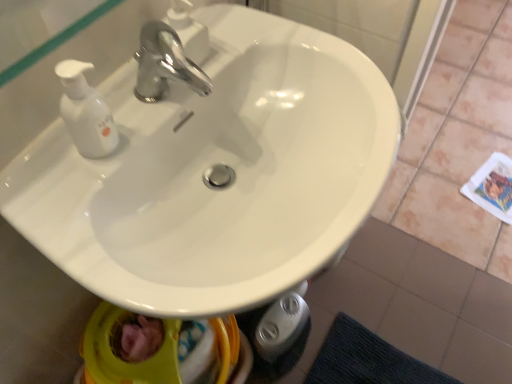
Question: From a real-world perspective, is chrome metallic faucet at upper center positioned under white glossy sink at center based on gravity?

Choices:
 (A) yes
 (B) no

Answer: (B)

Question: From the image's perspective, does chrome metallic faucet at upper center appear lower than white glossy sink at center?

Choices:
 (A) no
 (B) yes

Answer: (A)

Question: Can you confirm if chrome metallic faucet at upper center is taller than white glossy sink at center?

Choices:
 (A) no
 (B) yes

Answer: (A)

Question: Does chrome metallic faucet at upper center have a greater width compared to white glossy sink at center?

Choices:
 (A) no
 (B) yes

Answer: (A)

Question: Is chrome metallic faucet at upper center not near white glossy sink at center?

Choices:
 (A) yes
 (B) no

Answer: (B)

Question: Is chrome metallic faucet at upper center facing towards white glossy sink at center?

Choices:
 (A) no
 (B) yes

Answer: (A)

Question: From the image's perspective, is white glossy sink at center over chrome metallic faucet at upper center?

Choices:
 (A) yes
 (B) no

Answer: (B)

Question: Is white glossy sink at center positioned beyond the bounds of chrome metallic faucet at upper center?

Choices:
 (A) no
 (B) yes

Answer: (B)

Question: Can you confirm if white glossy sink at center is shorter than chrome metallic faucet at upper center?

Choices:
 (A) yes
 (B) no

Answer: (B)

Question: Is white glossy sink at center aimed at chrome metallic faucet at upper center?

Choices:
 (A) no
 (B) yes

Answer: (A)

Question: From a real-world perspective, is white glossy sink at center beneath chrome metallic faucet at upper center?

Choices:
 (A) no
 (B) yes

Answer: (B)

Question: Does white glossy sink at center have a lesser width compared to chrome metallic faucet at upper center?

Choices:
 (A) no
 (B) yes

Answer: (A)

Question: Is chrome metallic faucet at upper center wider or thinner than white glossy sink at center?

Choices:
 (A) thin
 (B) wide

Answer: (A)